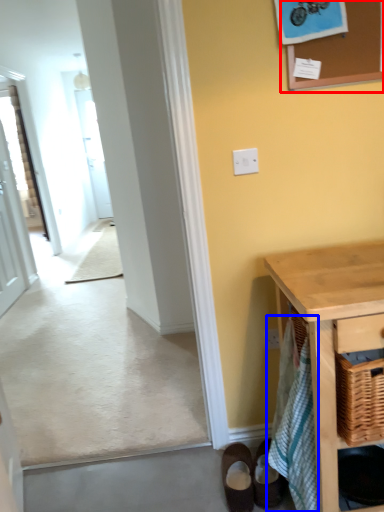
Question: Which point is closer to the camera, bulletin board (highlighted by a red box) or bath towel (highlighted by a blue box)?

Choices:
 (A) bulletin board
 (B) bath towel

Answer: (B)